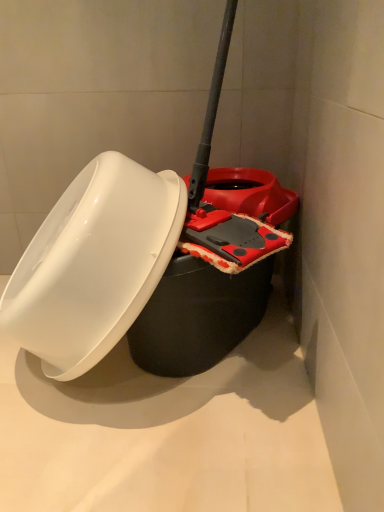
Image resolution: width=384 pixels, height=512 pixels. What do you see at coordinates (215, 275) in the screenshot?
I see `black matte toilet bowl at center` at bounding box center [215, 275].

Where is `black matte toilet bowl at center`? The height and width of the screenshot is (512, 384). black matte toilet bowl at center is located at coordinates (215, 275).

I want to click on black matte toilet bowl at center, so click(x=215, y=275).